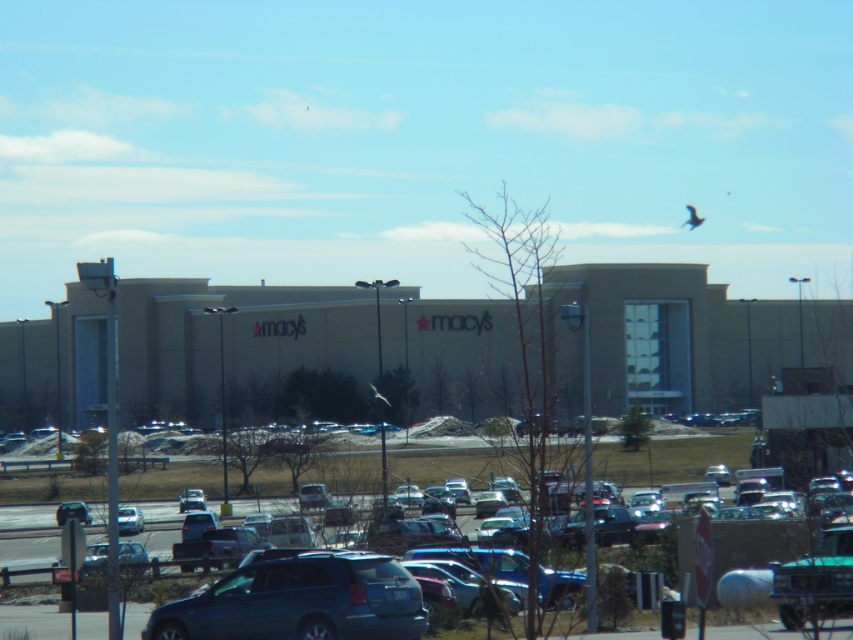
You are standing at the camera position and want to enter the Macy store. The entrance is located at the front of the building. Is the metallic blue suv at center blocking your path to the entrance?

The metallic blue suv at center and camera are 94.35 feet apart. Since the parking lot is moderately busy but not overcrowded, it is likely that the entrance path is clear, so the metallic blue suv at center is not blocking your path to the entrance.

Based on the photo, you are standing at the point labeled as point (x=683, y=339) in the image. Based on the scene description, what structure are you most likely standing on?

The point (x=683, y=339) corresponds to the beige concrete mall at center, so you are most likely standing on the beige concrete mall at center.

You are driving a metallic blue suv at center and want to park in the nearest available parking spot. The parking spots are 10 feet wide each. If the distance between you and the nearest parking spot is 94.35 feet, how many parking spots away should you aim for to ensure you reach the closest available spot without overshooting?

The distance between the metallic blue suv at center and the nearest parking spot is 94.35 feet. Since each parking spot is 10 feet wide, dividing 94.35 by 10 gives approximately 9.435. This means the metallic blue suv at center should aim for the 10th parking spot to ensure reaching the closest available spot without overshooting.